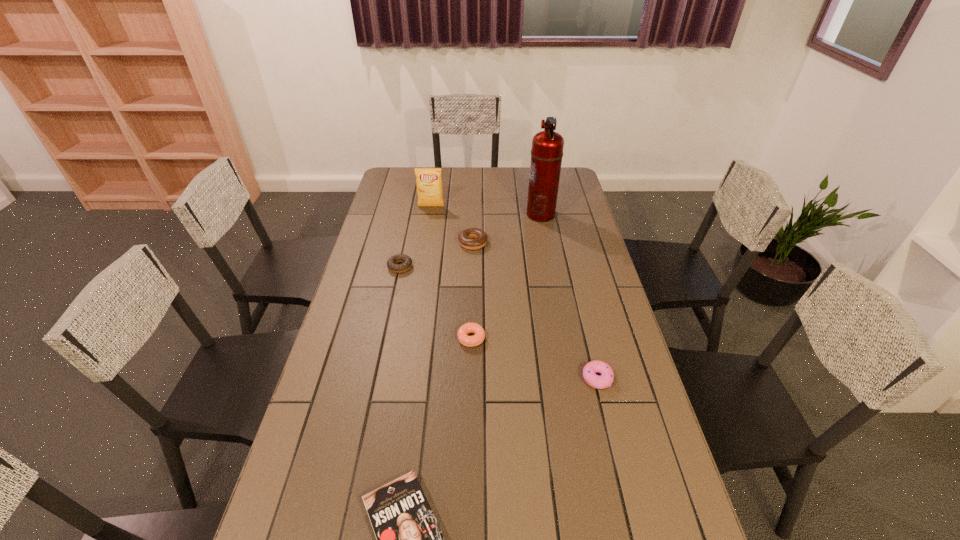
At what (x,y) coordinates should I click in order to perform the action: click on free space at the left edge of the desktop. Please return your answer as a coordinate pair (x, y). The width and height of the screenshot is (960, 540). Looking at the image, I should click on tap(413, 213).

You are a GUI agent. You are given a task and a screenshot of the screen. Output one action in this format:
    pyautogui.click(x=<x>, y=<y>)
    Task: Click on the free space at the right edge
    This screenshot has width=960, height=540.
    Given the screenshot: What is the action you would take?
    pyautogui.click(x=603, y=294)

Find the location of `free space at the far right corner of the desktop`. free space at the far right corner of the desktop is located at coordinates (572, 184).

Identify the location of vacant area between the nearest doughnut and the fourth nearest object. (498, 323).

You are a GUI agent. You are given a task and a screenshot of the screen. Output one action in this format:
    pyautogui.click(x=<x>, y=<y>)
    Task: Click on the vacant area that lies between the third nearest object and the crisp (potato chip)
    The image size is (960, 540).
    Given the screenshot: What is the action you would take?
    pyautogui.click(x=451, y=273)

Locate an element on the screen. Image resolution: width=960 pixels, height=540 pixels. free space between the tallest object and the nearest doughnut is located at coordinates click(x=569, y=296).

This screenshot has height=540, width=960. In order to click on free space between the sixth farthest object and the sixth shortest object in this screenshot , I will do `click(515, 293)`.

You are a GUI agent. You are given a task and a screenshot of the screen. Output one action in this format:
    pyautogui.click(x=<x>, y=<y>)
    Task: Click on the vacant space that is in between the farthest doughnut and the third farthest doughnut
    The image size is (960, 540).
    Given the screenshot: What is the action you would take?
    pyautogui.click(x=472, y=291)

Identify the location of vacant area that lies between the rightmost doughnut and the farthest doughnut. This screenshot has width=960, height=540. (535, 310).

Identify which object is the sixth nearest to the sixth farthest object. Please provide its 2D coordinates. Your answer should be formatted as a tuple, i.e. [(x, y)], where the tuple contains the x and y coordinates of a point satisfying the conditions above.

[(429, 180)]